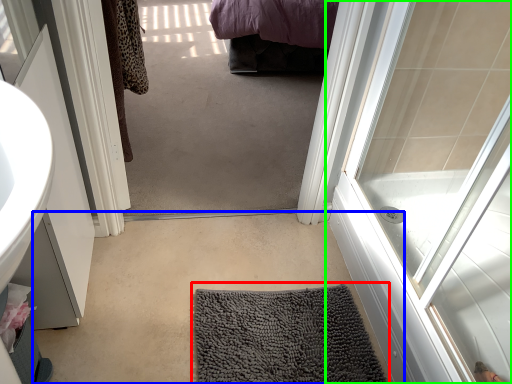
Question: Considering the real-world distances, which object is closest to bath mat (highlighted by a red box)? plain (highlighted by a blue box) or door (highlighted by a green box).

Choices:
 (A) plain
 (B) door

Answer: (A)